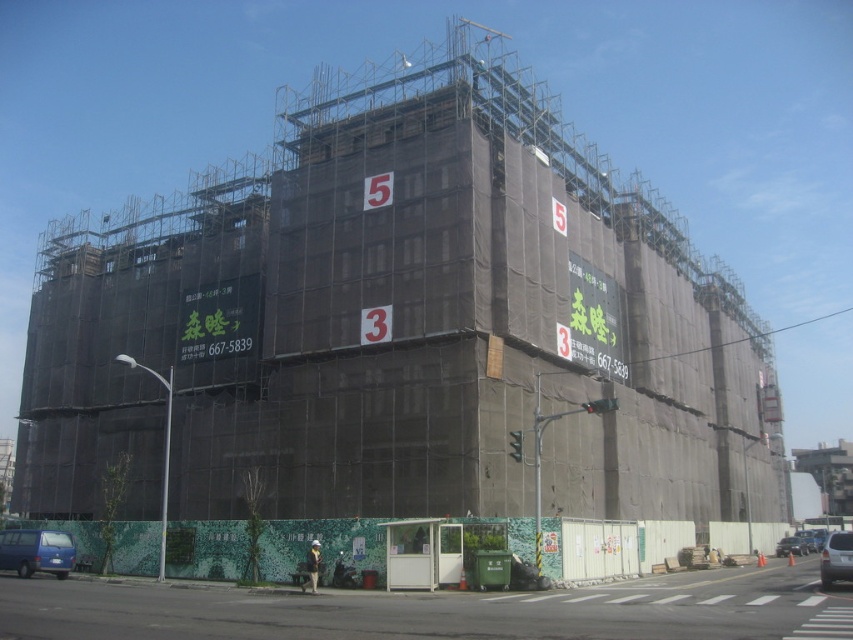
Which is above, green textured wall at lower center or blue matte van at lower left?

blue matte van at lower left is above.

Between point (416, 630) and point (18, 568), which one is positioned behind?

The point (18, 568) is behind.

Where is `green textured wall at lower center`? This screenshot has width=853, height=640. green textured wall at lower center is located at coordinates (439, 609).

Is green textured wall at lower center below metallic blue car at lower right?

No, green textured wall at lower center is not below metallic blue car at lower right.

Who is positioned more to the left, green textured wall at lower center or metallic blue car at lower right?

green textured wall at lower center is more to the left.

This screenshot has width=853, height=640. Find the location of `green textured wall at lower center`. green textured wall at lower center is located at coordinates (439, 609).

You are a GUI agent. You are given a task and a screenshot of the screen. Output one action in this format:
    pyautogui.click(x=<x>, y=<y>)
    Task: Click on the green textured wall at lower center
    
    Given the screenshot: What is the action you would take?
    pyautogui.click(x=439, y=609)

Is blue matte van at lower left wider than metallic blue car at lower right?

No.

The height and width of the screenshot is (640, 853). Describe the element at coordinates (36, 552) in the screenshot. I see `blue matte van at lower left` at that location.

Image resolution: width=853 pixels, height=640 pixels. Find the location of `blue matte van at lower left`. blue matte van at lower left is located at coordinates (36, 552).